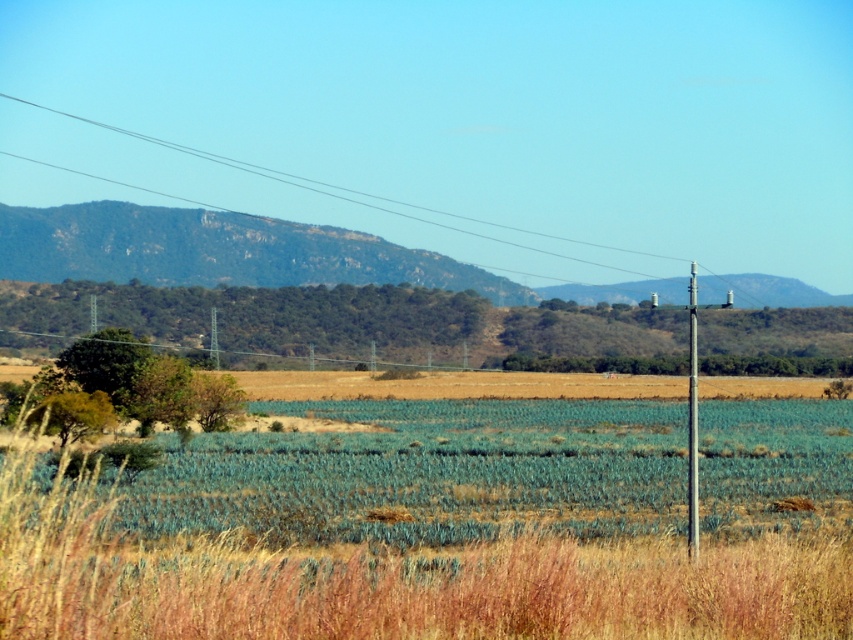
Is green rocky mountain at upper center thinner than metallic gray telegraph pole at right?

No.

Can you confirm if green rocky mountain at upper center is bigger than metallic gray telegraph pole at right?

Actually, green rocky mountain at upper center might be smaller than metallic gray telegraph pole at right.

Is point (184, 260) positioned after point (689, 444)?

Yes, point (184, 260) is behind point (689, 444).

Locate an element on the screen. This screenshot has height=640, width=853. green rocky mountain at upper center is located at coordinates (218, 252).

Can you confirm if dry grass at lower center is smaller than green rocky mountain at upper center?

No, dry grass at lower center is not smaller than green rocky mountain at upper center.

Which is behind, point (194, 502) or point (28, 246)?

The point (28, 246) is more distant.

At what (x,y) coordinates should I click in order to perform the action: click on dry grass at lower center. Please return your answer as a coordinate pair (x, y). The width and height of the screenshot is (853, 640). Looking at the image, I should click on (444, 525).

Where is `dry grass at lower center`? Image resolution: width=853 pixels, height=640 pixels. dry grass at lower center is located at coordinates (444, 525).

Does dry grass at lower center come in front of metallic gray telegraph pole at right?

Yes, it is.

Between point (700, 460) and point (693, 394), which one is positioned in front?

Point (693, 394)

Is point (15, 548) closer to camera compared to point (695, 467)?

Yes, point (15, 548) is closer to viewer.

Identify the location of dry grass at lower center. The width and height of the screenshot is (853, 640). (444, 525).